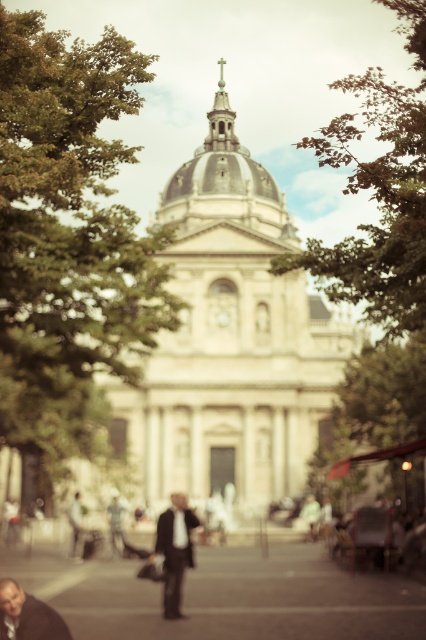
Question: Can you confirm if white stone church at center is bigger than green leafy tree at upper center?

Choices:
 (A) yes
 (B) no

Answer: (A)

Question: Is white stone church at center below matte brown jacket at lower left?

Choices:
 (A) yes
 (B) no

Answer: (B)

Question: Which point appears farthest from the camera in this image?

Choices:
 (A) (143, 250)
 (B) (173, 568)

Answer: (A)

Question: In this image, where is green leafy tree at upper center located relative to dark gray suit at center?

Choices:
 (A) below
 (B) above

Answer: (B)

Question: Which object is the closest to the green leafy tree at upper center?

Choices:
 (A) dark gray suit at center
 (B) matte brown jacket at lower left
 (C) green leafy tree at left
 (D) white stone church at center

Answer: (D)

Question: Which object is the closest to the green leafy tree at left?

Choices:
 (A) white stone church at center
 (B) matte brown jacket at lower left
 (C) green leafy tree at upper center

Answer: (A)